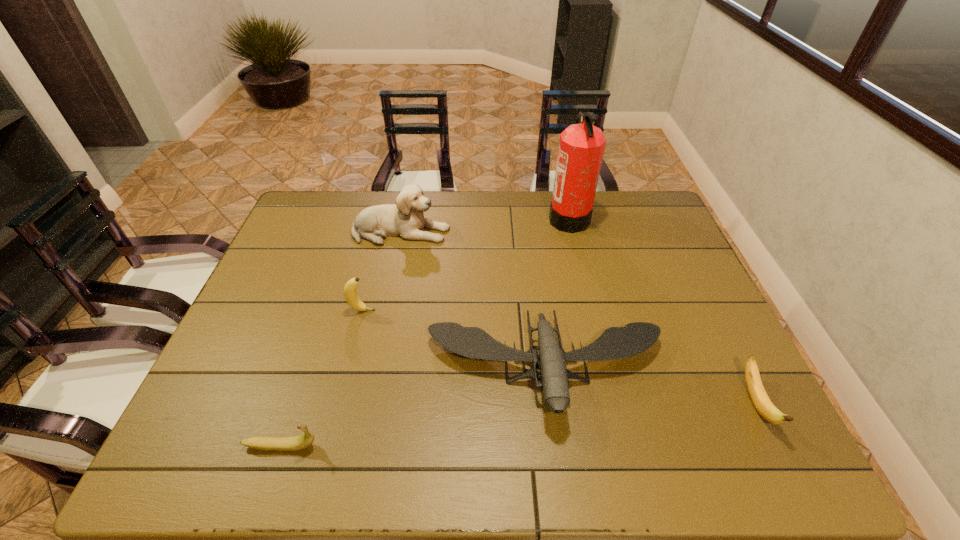
At what (x,y) coordinates should I click in order to perform the action: click on free spot between the farthest banana and the nearest banana. Please return your answer as a coordinate pair (x, y). This screenshot has width=960, height=540. Looking at the image, I should click on (322, 378).

What are the coordinates of `empty location between the nearest banana and the rightmost banana` in the screenshot? It's located at (518, 425).

I want to click on free space between the rightmost banana and the drone, so click(x=651, y=386).

Find the location of a particular element. This screenshot has width=960, height=540. empty location between the drone and the fire extinguisher is located at coordinates (558, 293).

Identify the location of object identified as the third closest to the second tallest object. (581, 148).

Select which object is the third closest to the nearest banana. Please provide its 2D coordinates. Your answer should be formatted as a tuple, i.e. [(x, y)], where the tuple contains the x and y coordinates of a point satisfying the conditions above.

[(405, 219)]

Point out which banana is positioned as the third nearest to the drone. Please provide its 2D coordinates. Your answer should be formatted as a tuple, i.e. [(x, y)], where the tuple contains the x and y coordinates of a point satisfying the conditions above.

[(301, 442)]

Locate an element on the screen. The height and width of the screenshot is (540, 960). the third closest banana to the fifth shortest object is located at coordinates (759, 397).

Locate an element on the screen. vacant space that satisfies the following two spatial constraints: 1. at the stem of the second nearest banana; 2. at the stem of the nearest banana is located at coordinates (777, 446).